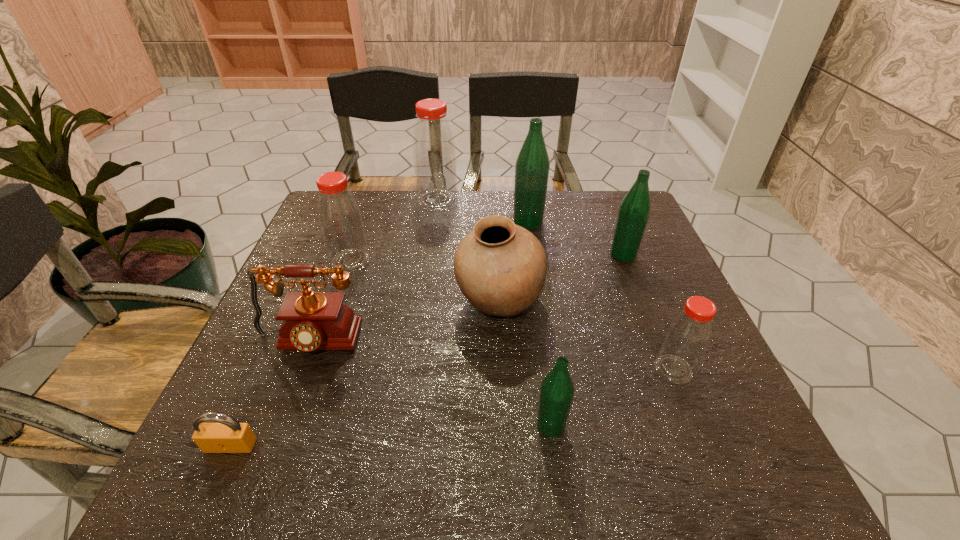
In the image, there is a desktop. Find the location of `free region at the right edge`. free region at the right edge is located at coordinates (606, 251).

Identify the location of vacant area at the far right corner. (606, 213).

Where is `vacant point located between the second nearest bottle and the second farthest bottle`? The height and width of the screenshot is (540, 960). vacant point located between the second nearest bottle and the second farthest bottle is located at coordinates (601, 295).

Find the location of a particular element. Image resolution: width=960 pixels, height=540 pixels. free space between the nearest red bottle and the telephone is located at coordinates (491, 356).

At what (x,y) coordinates should I click in order to perform the action: click on empty space between the pottery and the leftmost red bottle. Please return your answer as a coordinate pair (x, y). This screenshot has height=540, width=960. Looking at the image, I should click on (424, 281).

Where is `vacant area that lies between the pottery and the telephone`? This screenshot has height=540, width=960. vacant area that lies between the pottery and the telephone is located at coordinates (404, 322).

Locate an element on the screen. free space between the farthest green bottle and the nearest red bottle is located at coordinates (601, 295).

This screenshot has width=960, height=540. I want to click on unoccupied area between the second nearest bottle and the nearest green bottle, so click(x=612, y=397).

The height and width of the screenshot is (540, 960). I want to click on free space between the second bottle from left to right and the second nearest bottle, so click(x=556, y=285).

Image resolution: width=960 pixels, height=540 pixels. In order to click on free area in between the rightmost green bottle and the nearest green bottle in this screenshot , I will do `click(587, 340)`.